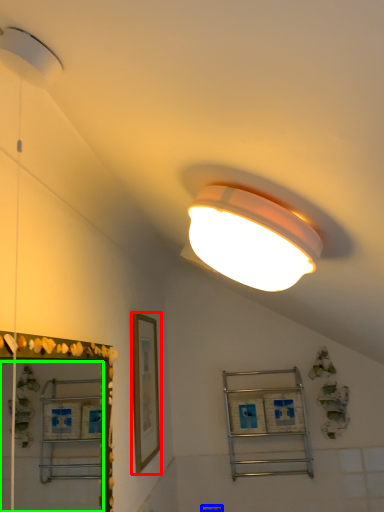
Question: Estimate the real-world distances between objects in this image. Which object is farther from picture frame (highlighted by a red box), electric outlet (highlighted by a blue box) or mirror (highlighted by a green box)?

Choices:
 (A) electric outlet
 (B) mirror

Answer: (A)